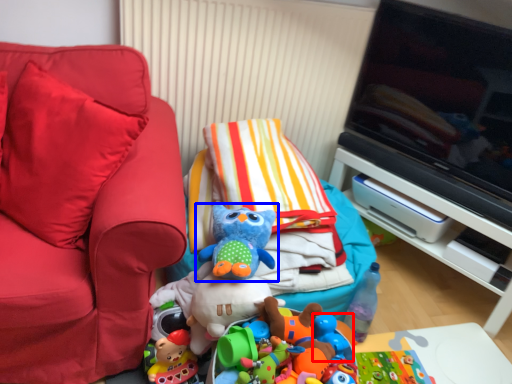
Question: Which of the following is the farthest to the observer, toy (highlighted by a red box) or toy (highlighted by a blue box)?

Choices:
 (A) toy
 (B) toy

Answer: (A)